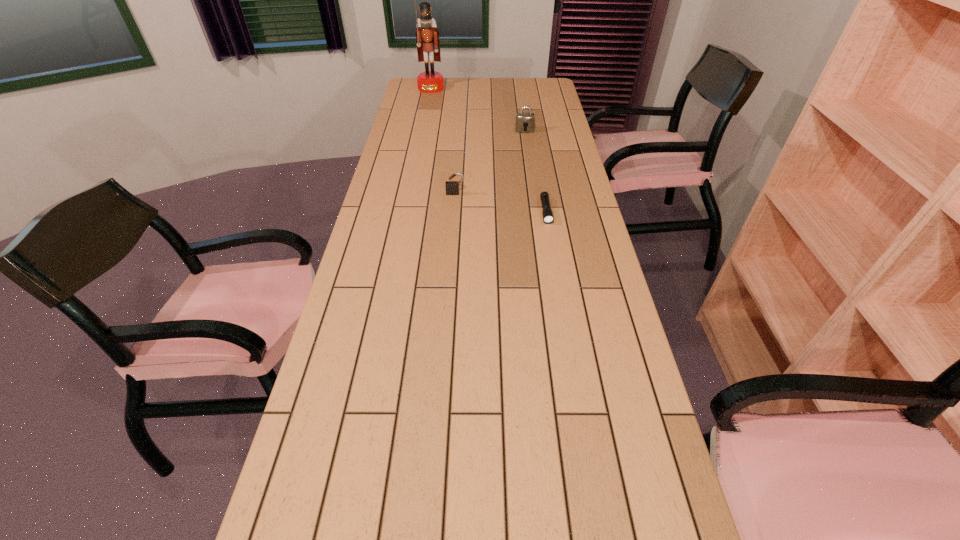
In the image, there is a desktop. At what (x,y) coordinates should I click in order to perform the action: click on vacant space at the far left corner. Please return your answer as a coordinate pair (x, y). Looking at the image, I should click on (414, 82).

This screenshot has width=960, height=540. What are the coordinates of `free space at the far right corner of the desktop` in the screenshot? It's located at (536, 78).

What are the coordinates of `unoccupied position between the leftmost object and the right padlock` in the screenshot? It's located at (478, 110).

Locate an element on the screen. free spot between the farthest object and the nearest object is located at coordinates (489, 150).

Find the location of `free space that is in between the leftmost object and the nearer padlock`. free space that is in between the leftmost object and the nearer padlock is located at coordinates (444, 141).

Identify the location of vacant point located between the nearest object and the tallest object. The width and height of the screenshot is (960, 540). (489, 150).

Find the location of a particular element. unoccupied area between the left padlock and the taller padlock is located at coordinates (490, 162).

Identify the location of empty space that is in between the nearest object and the farther padlock. The width and height of the screenshot is (960, 540). (536, 171).

This screenshot has width=960, height=540. I want to click on vacant region between the second tallest object and the flashlight, so coord(536,171).

Identify the location of blank region between the nearest object and the farther padlock. (536, 171).